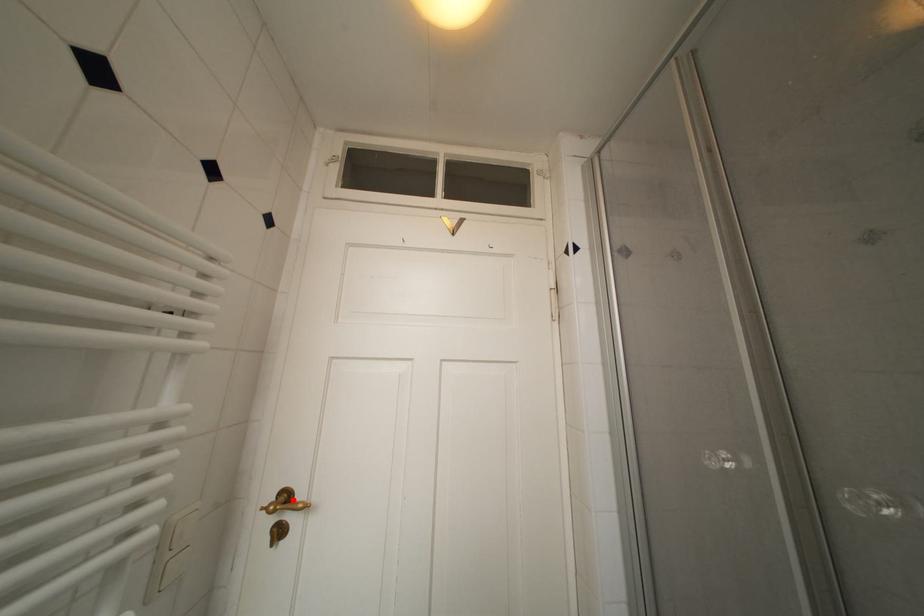
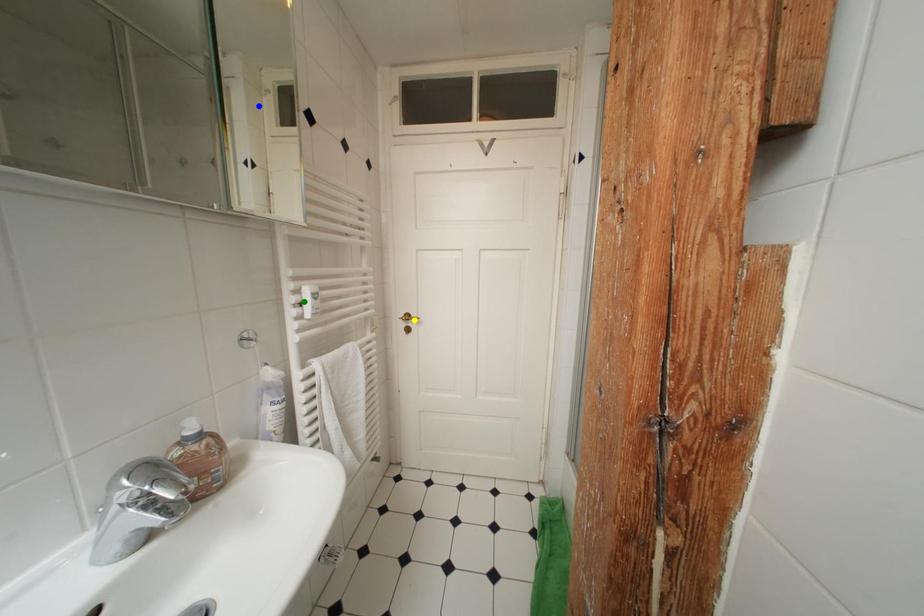
Question: I am providing you with two images of the same scene from different viewpoints. A red point is marked on the first image. You are given multiple points on the second image. Which spot in image 2 lines up with the point in image 1?

Choices:
 (A) yellow point
 (B) blue point
 (C) green point

Answer: (A)